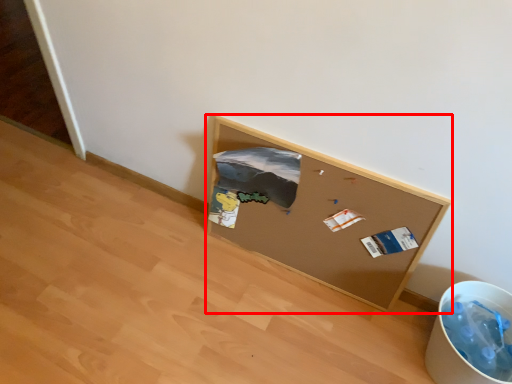
Question: In this image, where is furniture (annotated by the red box) located relative to recycling bin?

Choices:
 (A) left
 (B) right

Answer: (A)